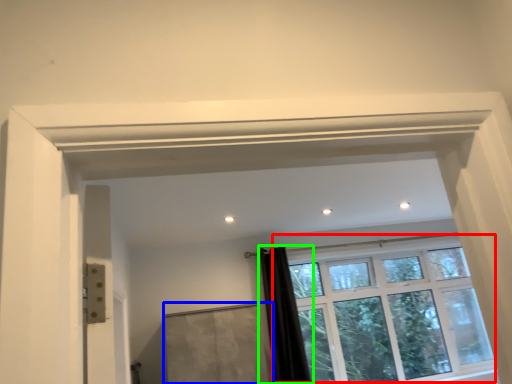
Question: Based on their relative distances, which object is farther from window (highlighted by a red box)? Choose from screen door (highlighted by a blue box) and shower curtain (highlighted by a green box).

Choices:
 (A) screen door
 (B) shower curtain

Answer: (A)